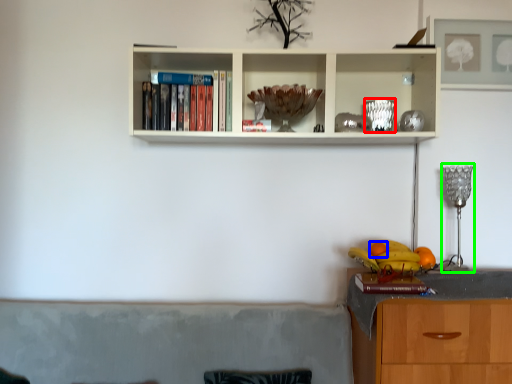
Question: Based on their relative distances, which object is nearer to glass vase (highlighted by a red box)? Choose from orange (highlighted by a blue box) and lamp (highlighted by a green box).

Choices:
 (A) orange
 (B) lamp

Answer: (B)